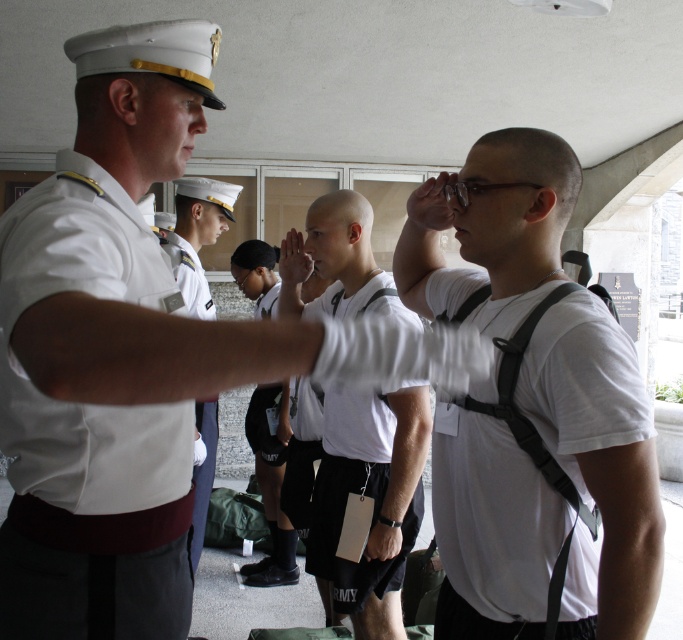
Based on the scene description, where is the white matte uniform at center located in the image?

The white matte uniform at center is located at point (111, 353).

You are an observer in the scene and need to determine which clothing item is wider between the white matte shirt at center and the white uniform at center. Which one is wider?

The white matte shirt at center is wider than the white uniform at center.